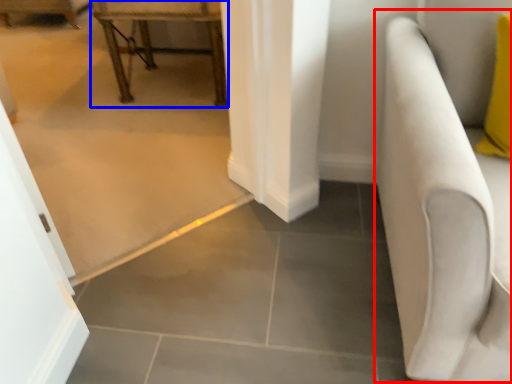
Question: Which object is further to the camera taking this photo, armchair (highlighted by a red box) or furniture (highlighted by a blue box)?

Choices:
 (A) armchair
 (B) furniture

Answer: (B)